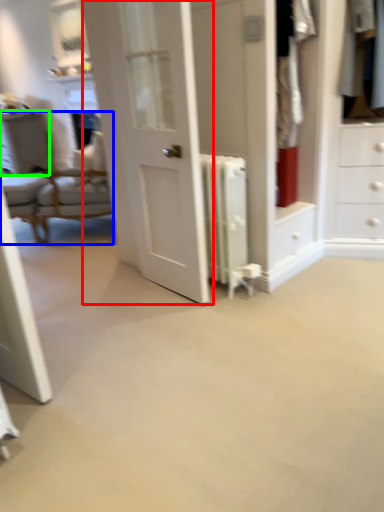
Question: Estimate the real-world distances between objects in this image. Which object is closer to door (highlighted by a red box), chair (highlighted by a blue box) or vanity (highlighted by a green box)?

Choices:
 (A) chair
 (B) vanity

Answer: (A)